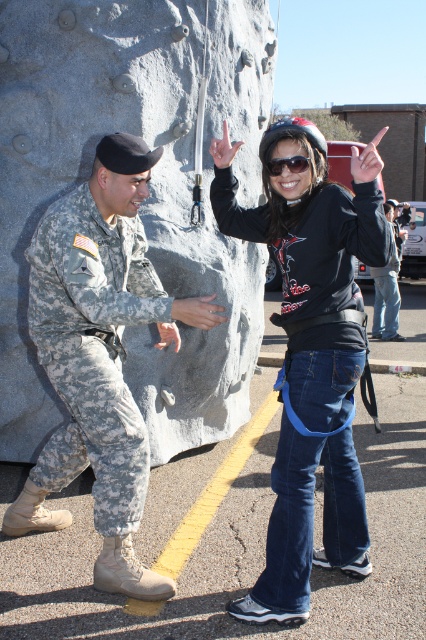
Can you confirm if black matte hoodie at center is positioned to the right of matte gray ring at center?

Indeed, black matte hoodie at center is positioned on the right side of matte gray ring at center.

Does black matte hoodie at center appear over matte gray ring at center?

No, black matte hoodie at center is not above matte gray ring at center.

Where is `black matte hoodie at center`? The width and height of the screenshot is (426, 640). black matte hoodie at center is located at coordinates (311, 264).

Find the location of a particular element. black matte hoodie at center is located at coordinates (311, 264).

Between black matte hoodie at center and sunglasses at center, which one appears on the right side from the viewer's perspective?

black matte hoodie at center is more to the right.

Based on the photo, can you confirm if black matte hoodie at center is thinner than sunglasses at center?

No.

What do you see at coordinates (311, 264) in the screenshot? I see `black matte hoodie at center` at bounding box center [311, 264].

The width and height of the screenshot is (426, 640). What are the coordinates of `black matte hoodie at center` in the screenshot? It's located at (311, 264).

Between matte gray ring at center and sunglasses at center, which one appears on the left side from the viewer's perspective?

Positioned to the left is matte gray ring at center.

Which is behind, point (201, 323) or point (301, 170)?

Positioned behind is point (201, 323).

Locate an element on the screen. This screenshot has width=426, height=640. matte gray ring at center is located at coordinates (198, 310).